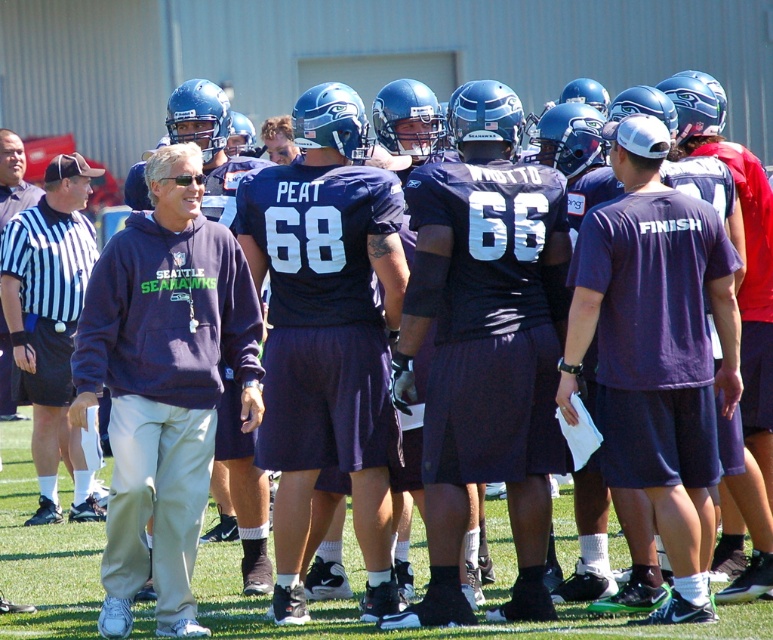
From the picture: You are a photographer trying to capture a group photo of the football team. You notice two sweatshirts in the frame. The navy fleece sweatshirt at center and the dark blue sweatshirt at left. Which sweatshirt should you ask the wearer to stand on a small stool so that their face is visible in the photo?

The navy fleece sweatshirt at center has a lesser height compared to dark blue sweatshirt at left, so the wearer of the navy fleece sweatshirt at center should stand on a small stool to make their face visible in the photo.

You are a coach observing the players during practice. You notice two sweatshirts left behind by the team. The navy fleece sweatshirt at center and the dark blue sweatshirt at left. Which one is larger in size?

The navy fleece sweatshirt at center is bigger than the dark blue sweatshirt at left, so the navy fleece sweatshirt at center is larger in size.